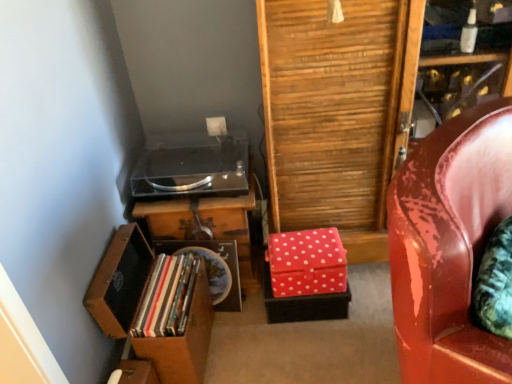
Question: Is point (257, 251) closer or farther from the camera than point (471, 327)?

Choices:
 (A) farther
 (B) closer

Answer: (A)

Question: Is wooden table at center bigger or smaller than glossy leather chair at right?

Choices:
 (A) small
 (B) big

Answer: (A)

Question: Estimate the real-world distances between objects in this image. Which object is closer to the matte plastic books at lower left?

Choices:
 (A) wooden chest of drawers at lower left
 (B) wooden table at center
 (C) transparent acrylic stereo at center
 (D) glossy leather chair at right
 (E) red polka dot fabric box at lower right

Answer: (A)

Question: Which of these objects is positioned farthest from the transparent acrylic stereo at center?

Choices:
 (A) wooden chest of drawers at lower left
 (B) glossy leather chair at right
 (C) matte plastic books at lower left
 (D) wooden table at center
 (E) red polka dot fabric box at lower right

Answer: (B)